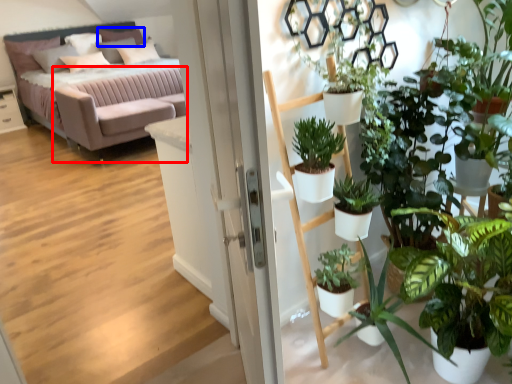
Question: Which object appears closest to the camera in this image, couch (highlighted by a red box) or pillow (highlighted by a blue box)?

Choices:
 (A) couch
 (B) pillow

Answer: (A)